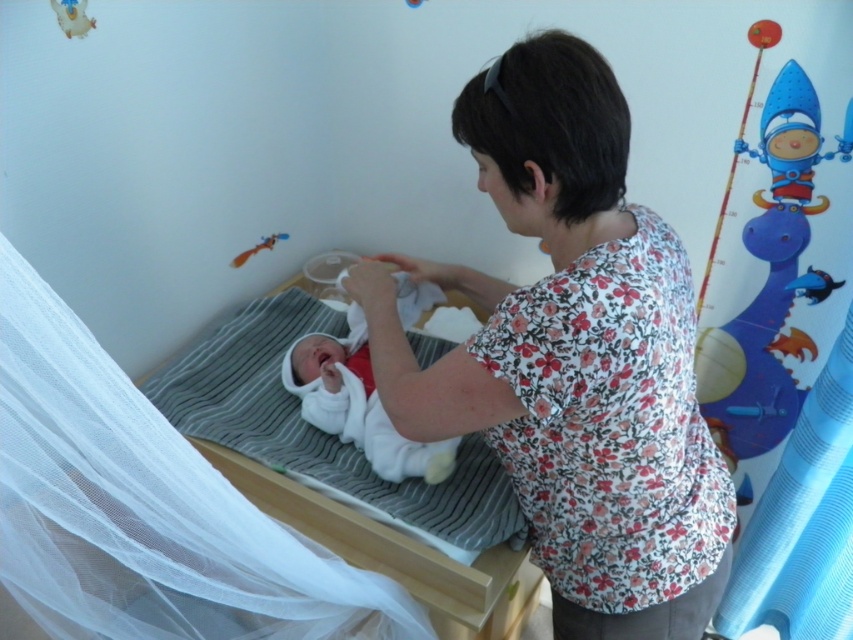
Question: Which of the following is the closest to the observer?

Choices:
 (A) blue fabric curtain at lower right
 (B) white soft baby at center
 (C) matte orange toy at upper left
 (D) floral fabric shirt at center

Answer: (D)

Question: Considering the relative positions of blue fabric curtain at lower right and white soft baby at center in the image provided, where is blue fabric curtain at lower right located with respect to white soft baby at center?

Choices:
 (A) below
 (B) above

Answer: (A)

Question: Can you confirm if white striped fabric at center is positioned below white soft baby at center?

Choices:
 (A) no
 (B) yes

Answer: (B)

Question: Which point appears closest to the camera in this image?

Choices:
 (A) (762, 509)
 (B) (265, 240)
 (C) (786, 186)

Answer: (C)

Question: Estimate the real-world distances between objects in this image. Which object is closer to the blue fabric rocket at upper right?

Choices:
 (A) white soft baby at center
 (B) white striped fabric at center

Answer: (A)

Question: Is blue fabric curtain at lower right positioned behind matte orange toy at upper left?

Choices:
 (A) yes
 (B) no

Answer: (B)